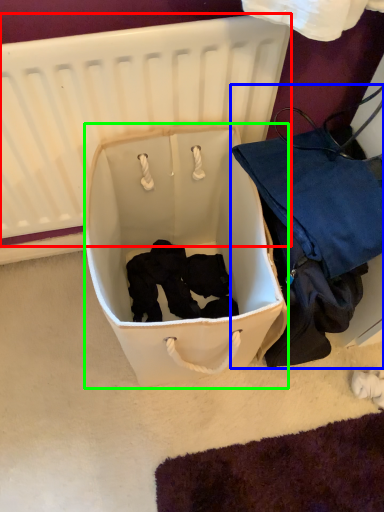
Question: Estimate the real-world distances between objects in this image. Which object is closer to infant bed (highlighted by a red box), luggage and bags (highlighted by a blue box) or storage box (highlighted by a green box)?

Choices:
 (A) luggage and bags
 (B) storage box

Answer: (B)